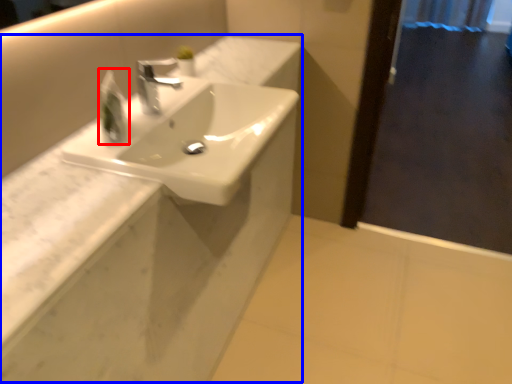
Question: Among these objects, which one is nearest to the camera, soap dispenser (highlighted by a red box) or counter (highlighted by a blue box)?

Choices:
 (A) soap dispenser
 (B) counter

Answer: (B)